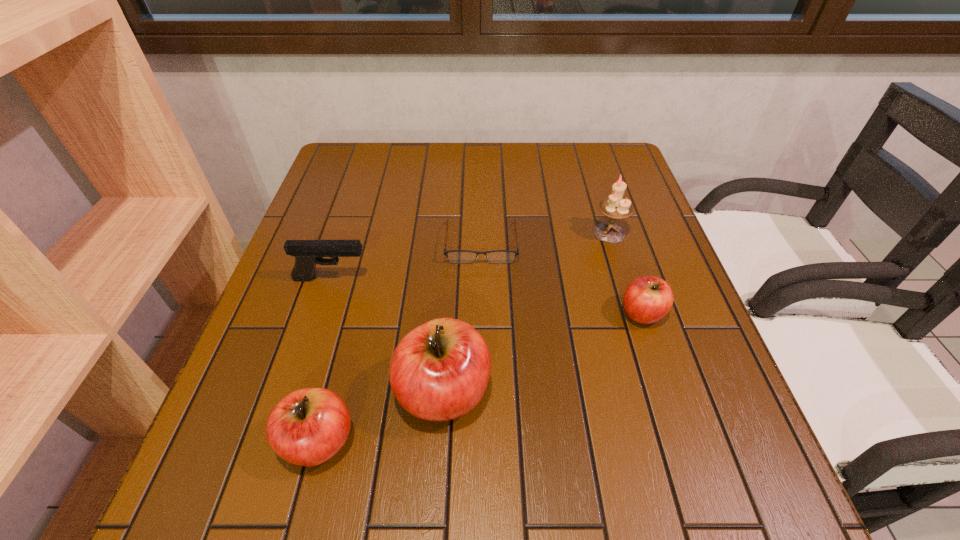
Where is `vacant area that satisfies the following two spatial constraints: 1. on the front-facing side of the pistol; 2. on the right side of the rightmost apple`? vacant area that satisfies the following two spatial constraints: 1. on the front-facing side of the pistol; 2. on the right side of the rightmost apple is located at coordinates pyautogui.click(x=321, y=314).

Where is `free space that satisfies the following two spatial constraints: 1. on the front-facing side of the shortest object; 2. on the front-facing side of the third farthest object`? free space that satisfies the following two spatial constraints: 1. on the front-facing side of the shortest object; 2. on the front-facing side of the third farthest object is located at coordinates (481, 279).

Identify the location of vacant space that satisfies the following two spatial constraints: 1. on the back side of the second apple from right to left; 2. on the right side of the candle holder. (454, 233).